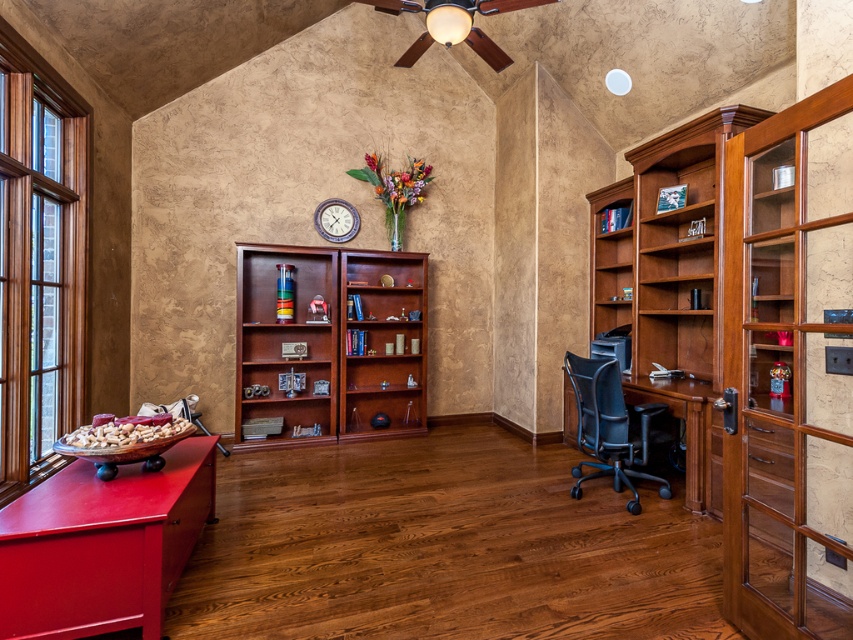
You are standing in the center of the room and want to move to the matte red cabinet at lower left. Which direction should you walk towards?

The matte red cabinet at lower left is located at point (102, 545), so you should walk towards the lower left direction to reach it.